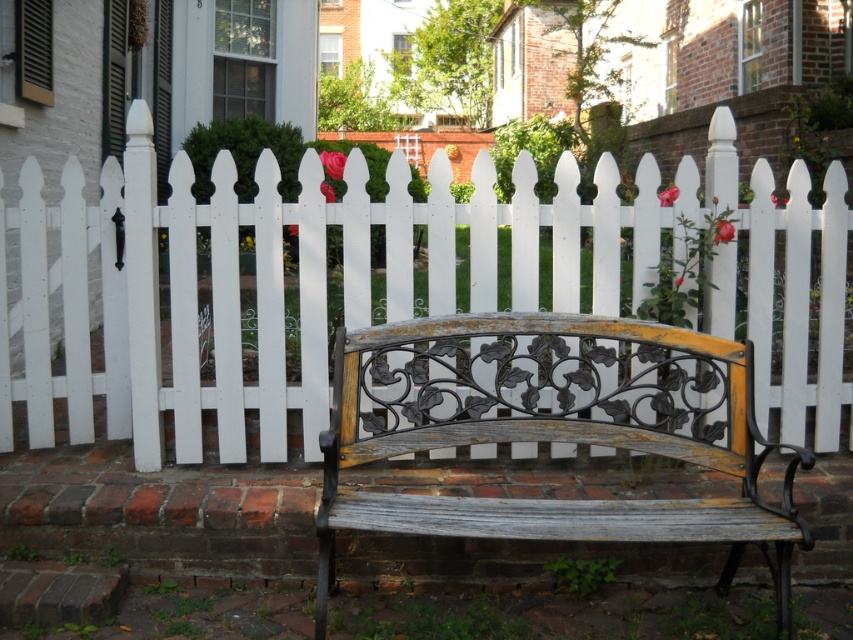
Consider the image. You are standing at the center of the image and want to locate the white picket fence at center. What are the coordinates where you should look?

The white picket fence at center is located at coordinates point (281, 284).

You are a painter hired to paint the white picket fence at center and the distressed wood bench at center. You have a ladder that can reach up to 2 meters. Can you paint both objects without moving the ladder?

The white picket fence at center is much taller than the distressed wood bench at center. Since the ladder can reach up to 2 meters, you need to check if both objects are within that height. If the fence exceeds 2 meters, you won

You are standing in front of the white picket fence and see two points marked in the scene. Which point is closer to you, point (88, 252) or point (445, 508)?

Point (88, 252) is closer to you because it is further to the viewer than point (445, 508).